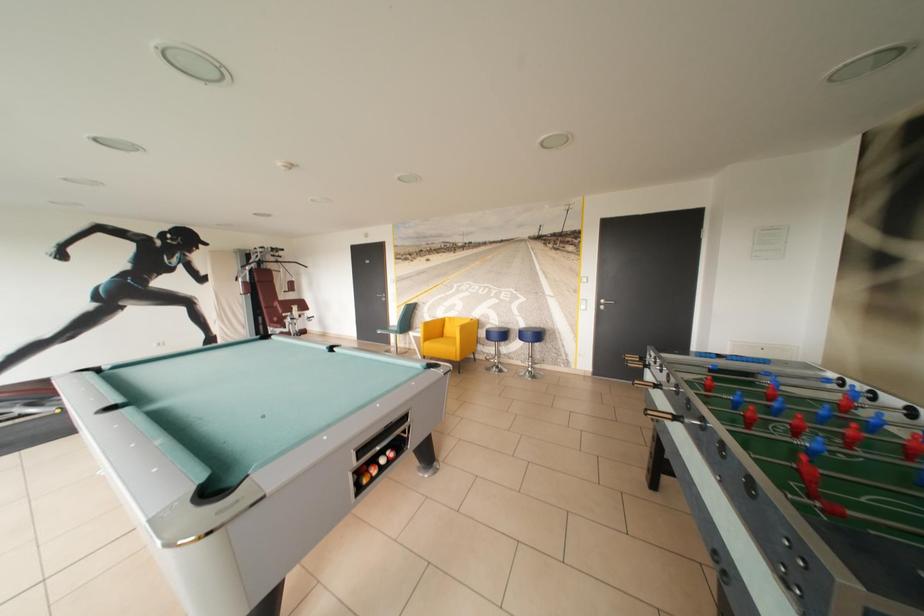
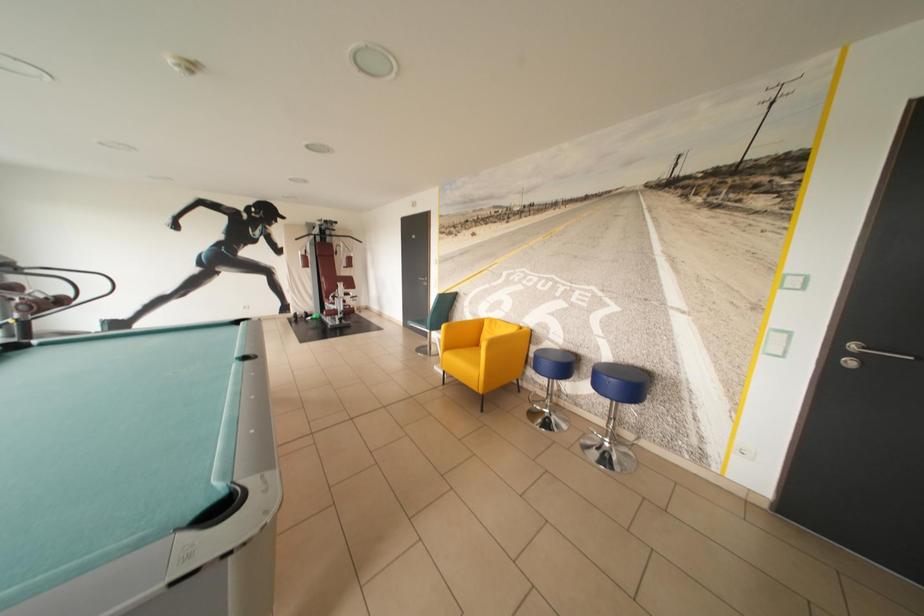
Which direction would the cameraman need to move to produce the second image?

The movement direction of the cameraman is right, forward.